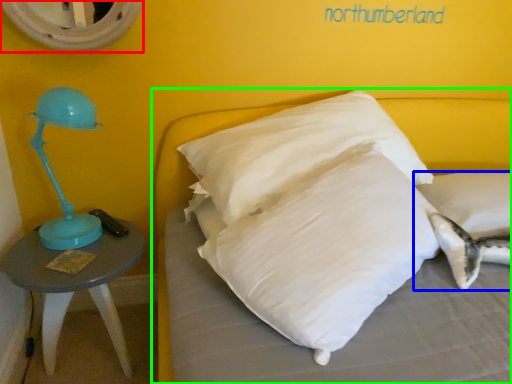
Question: Which object is positioned closest to mirror (highlighted by a red box)? Select from pillow (highlighted by a blue box) and bed (highlighted by a green box).

Choices:
 (A) pillow
 (B) bed

Answer: (B)